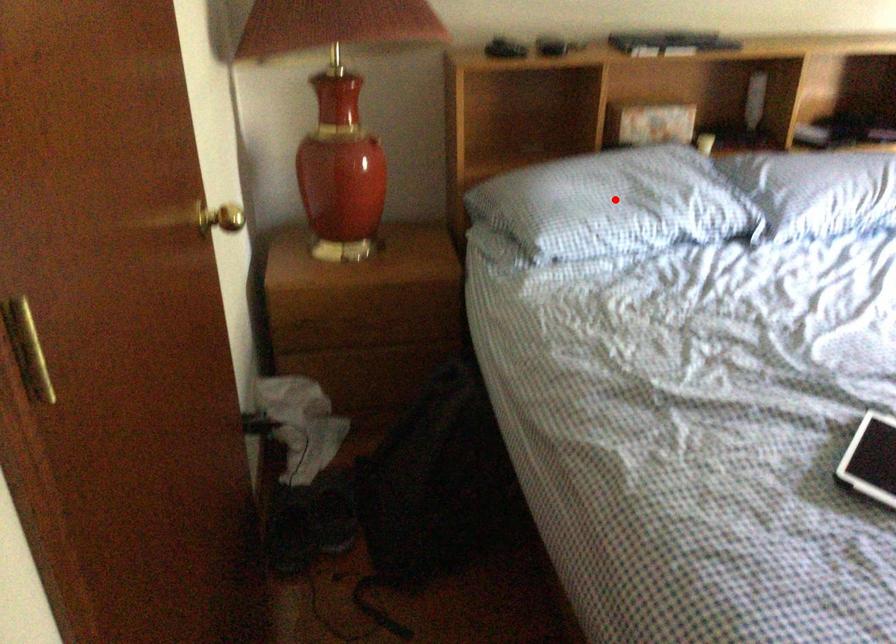
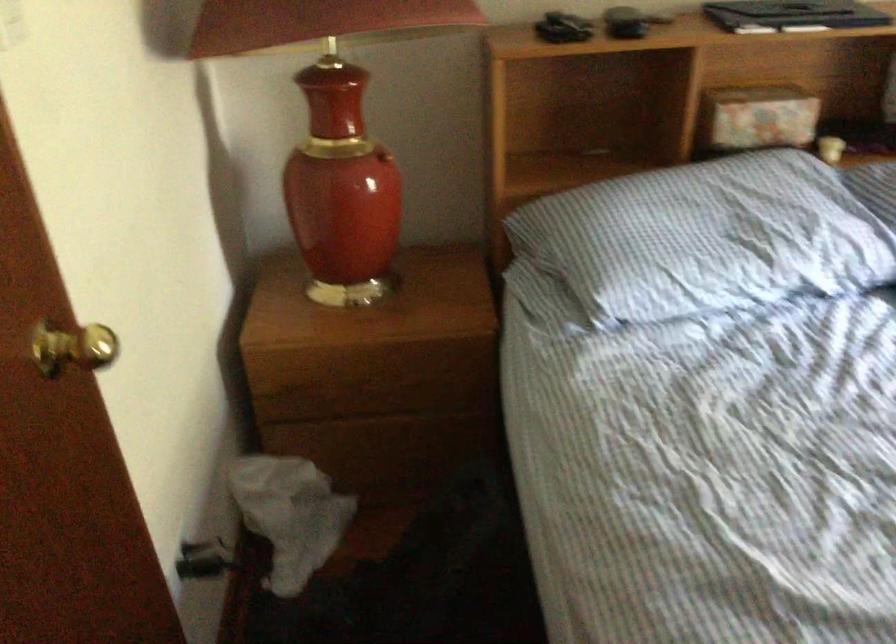
Question: I am providing you with two images of the same scene from different viewpoints. A red point is shown in image1. For the corresponding object point in image2, is it positioned nearer or farther from the camera?

Choices:
 (A) Nearer
 (B) Farther

Answer: (A)